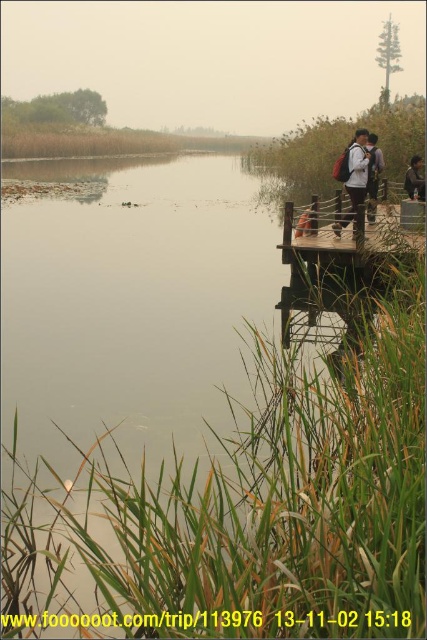
You are a photographer trying to capture a wide shot of the wooden dock at center and the matte brown backpack at upper right. Given their sizes, which object should you frame first to ensure both are visible in the photo?

The wooden dock at center is bigger than the matte brown backpack at upper right, so you should frame the wooden dock at center first to ensure both objects are visible in the photo.

You are standing on the wooden dock at center and want to place your matte black backpack at upper right somewhere. Based on the scene, where should you place it so that it aligns with the existing objects?

The wooden dock at center is located below the matte black backpack at upper right, so you should place the matte black backpack at upper right above the wooden dock at center to maintain alignment with the scene.

You are a tour guide leading a group along the wooden walkway. You notice two backpacks left on the railing at the upper right corner of the walkway. The group is about to move forward. To ensure safety, you need to know if the two backpacks are close enough to prevent them from falling off the railing. Can the two backpacks, the matte brown backpack at upper right and the matte black backpack at upper right, be placed securely side by side on the railing without overlapping?

The matte brown backpack at upper right and the matte black backpack at upper right are 3.57 feet apart. Since the distance between them is greater than the combined width of the backpacks, they can be placed securely side by side on the railing without overlapping.